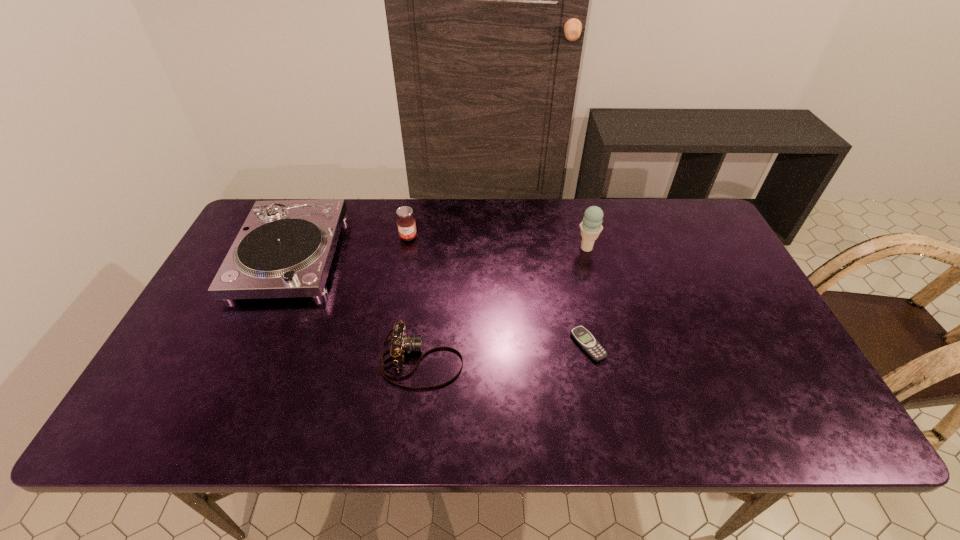
Choose which object is the nearest neighbor to the record player. Please provide its 2D coordinates. Your answer should be formatted as a tuple, i.e. [(x, y)], where the tuple contains the x and y coordinates of a point satisfying the conditions above.

[(406, 224)]

Locate an element on the screen. This screenshot has width=960, height=540. the closest object to the beeper is located at coordinates (401, 343).

This screenshot has width=960, height=540. I want to click on vacant space that satisfies the following two spatial constraints: 1. on the label side of the shortest object; 2. on the left side of the jam, so click(389, 345).

Where is `free space that satisfies the following two spatial constraints: 1. on the back side of the record player; 2. on the left side of the tallest object`? The width and height of the screenshot is (960, 540). free space that satisfies the following two spatial constraints: 1. on the back side of the record player; 2. on the left side of the tallest object is located at coordinates (294, 248).